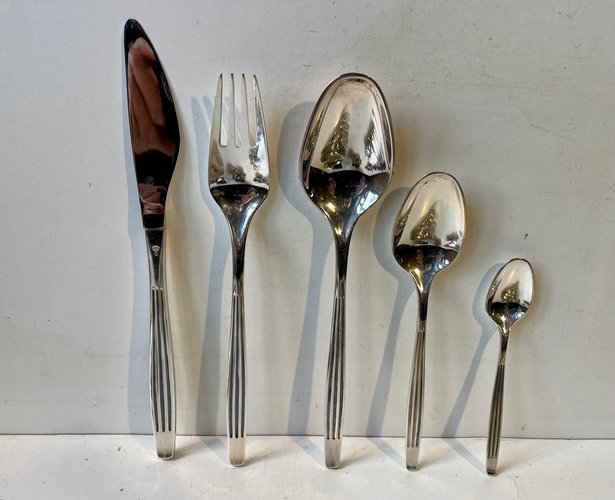
You are a GUI agent. You are given a task and a screenshot of the screen. Output one action in this format:
    pyautogui.click(x=<x>, y=<y>)
    Task: Click on the silver eating utensils
    
    Given the screenshot: What is the action you would take?
    pyautogui.click(x=167, y=134), pyautogui.click(x=247, y=169), pyautogui.click(x=333, y=156), pyautogui.click(x=435, y=233), pyautogui.click(x=518, y=297)